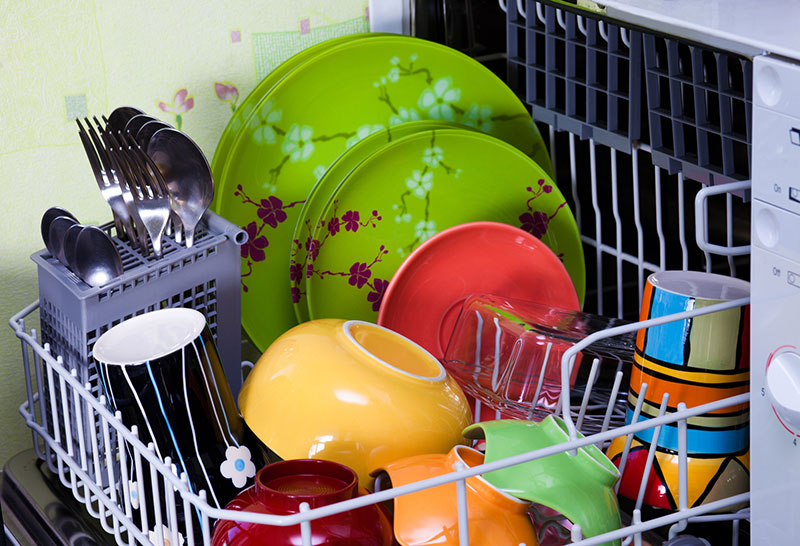
Find the location of a particular element. The height and width of the screenshot is (546, 800). plates is located at coordinates (229, 133), (240, 150), (316, 193), (352, 216), (426, 276).